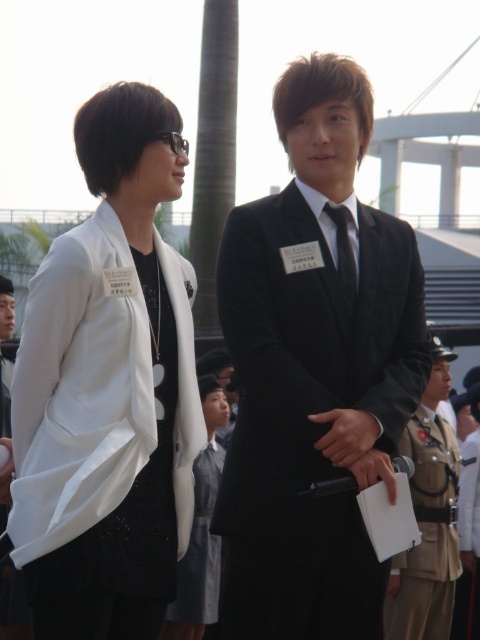
You are at a formal event and need to determine the spatial arrangement of the attendees based on their clothing. Given the black velvet suit at center and the black satin tie at center, which one is positioned to the right side?

The black satin tie at center is positioned to the right of the black velvet suit at center.

You are organizing a photo shoot and need to ensure that the white matte blazer at left and the black satin tie at center are visible in the frame. Based on their positions and sizes, which object is more likely to be fully visible without cropping?

The white matte blazer at left is wider than the black satin tie at center, so it is more likely to be fully visible without cropping.